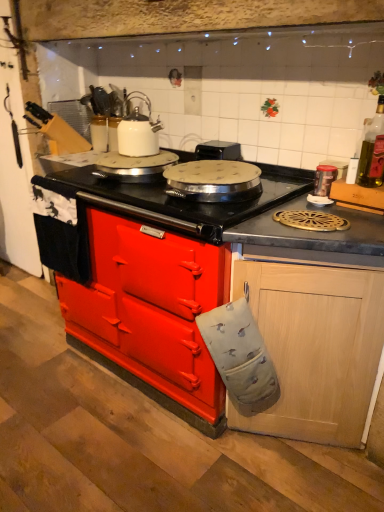
The height and width of the screenshot is (512, 384). In order to click on white glossy kettle at upper center, placed as the 2th kitchen appliance when sorted from right to left in this screenshot , I will do `click(138, 130)`.

This screenshot has width=384, height=512. Describe the element at coordinates (138, 130) in the screenshot. I see `white glossy kettle at upper center, the 1th kitchen appliance positioned from the back` at that location.

The width and height of the screenshot is (384, 512). Describe the element at coordinates (218, 150) in the screenshot. I see `black plastic toaster at upper center` at that location.

The image size is (384, 512). What do you see at coordinates (324, 179) in the screenshot?
I see `metallic silver canister at upper right, marked as the 1th kitchen appliance in a bottom-to-top arrangement` at bounding box center [324, 179].

Identify the location of black matte countertop at center. This screenshot has width=384, height=512. (128, 303).

Find the location of a particular element. This screenshot has width=384, height=512. green glass bottle at upper right is located at coordinates (372, 150).

The width and height of the screenshot is (384, 512). In order to click on the 1st kitchen appliance directly above the light wood/texture cabinet at lower right (from a real-world perspective) in this screenshot , I will do `click(324, 179)`.

Is light wood/texture cabinet at lower right placed right next to metallic silver canister at upper right, the first kitchen appliance viewed from the front?

No, light wood/texture cabinet at lower right is not next to metallic silver canister at upper right, the first kitchen appliance viewed from the front.

Is light wood/texture cabinet at lower right turned away from metallic silver canister at upper right, marked as the 1th kitchen appliance in a bottom-to-top arrangement?

No, metallic silver canister at upper right, marked as the 1th kitchen appliance in a bottom-to-top arrangement, is not at the back of light wood/texture cabinet at lower right.

From the image's perspective, which is below, light wood/texture cabinet at lower right or metallic silver canister at upper right, the first kitchen appliance viewed from the front?

light wood/texture cabinet at lower right.

Is green glass bottle at upper right not close to black plastic toaster at upper center?

No, green glass bottle at upper right is not far away from black plastic toaster at upper center.

From the picture: Is green glass bottle at upper right inside or outside of black plastic toaster at upper center?

green glass bottle at upper right is spatially situated outside black plastic toaster at upper center.

Who is smaller, green glass bottle at upper right or black plastic toaster at upper center?

With smaller size is green glass bottle at upper right.

Does green glass bottle at upper right contain light wood/texture cabinet at lower right?

No, light wood/texture cabinet at lower right is located outside of green glass bottle at upper right.

Based on the photo, are green glass bottle at upper right and light wood/texture cabinet at lower right located far from each other?

green glass bottle at upper right is near light wood/texture cabinet at lower right, not far away.

From the image's perspective, is green glass bottle at upper right located above or below light wood/texture cabinet at lower right?

Based on their image positions, green glass bottle at upper right is located above light wood/texture cabinet at lower right.

I want to click on the 2nd kitchen appliance directly beneath the green glass bottle at upper right (from a real-world perspective), so click(x=324, y=179).

From the image's perspective, which is above, metallic silver canister at upper right, marked as the 1th kitchen appliance in a bottom-to-top arrangement, or green glass bottle at upper right?

green glass bottle at upper right is shown above in the image.

Considering the relative positions of metallic silver canister at upper right, which ranks as the 1th kitchen appliance in right-to-left order, and green glass bottle at upper right in the image provided, is metallic silver canister at upper right, which ranks as the 1th kitchen appliance in right-to-left order, to the right of green glass bottle at upper right from the viewer's perspective?

No.

From a real-world perspective, is black plastic toaster at upper center positioned above or below green glass bottle at upper right?

In terms of real-world spatial position, black plastic toaster at upper center is below green glass bottle at upper right.

Considering the sizes of objects black plastic toaster at upper center and green glass bottle at upper right in the image provided, who is wider, black plastic toaster at upper center or green glass bottle at upper right?

Wider between the two is black plastic toaster at upper center.

Is black plastic toaster at upper center not near green glass bottle at upper right?

No, black plastic toaster at upper center is not far from green glass bottle at upper right.

Does point (237, 150) appear closer or farther from the camera than point (363, 159)?

Point (237, 150) appears to be farther away from the viewer than point (363, 159).

Which point is more distant from viewer, (205, 399) or (218, 148)?

The point (218, 148) is more distant.

Can you tell me how much black matte countertop at center and black plastic toaster at upper center differ in facing direction?

The angle between the facing direction of black matte countertop at center and the facing direction of black plastic toaster at upper center is 0.725 degrees.

From a real-world perspective, is black matte countertop at center beneath black plastic toaster at upper center?

Correct, in the physical world, black matte countertop at center is lower than black plastic toaster at upper center.

Consider the image. Who is taller, black matte countertop at center or black plastic toaster at upper center?

black matte countertop at center is taller.

Based on the photo, considering the positions of objects black matte countertop at center and metallic silver canister at upper right, the first kitchen appliance viewed from the front, in the image provided, who is in front, black matte countertop at center or metallic silver canister at upper right, the first kitchen appliance viewed from the front,?

black matte countertop at center is in front.

Considering the sizes of objects black matte countertop at center and metallic silver canister at upper right, placed as the second kitchen appliance when sorted from top to bottom, in the image provided, who is bigger, black matte countertop at center or metallic silver canister at upper right, placed as the second kitchen appliance when sorted from top to bottom,?

Bigger between the two is black matte countertop at center.

Is point (168, 224) more distant than point (321, 196)?

No, (168, 224) is in front of (321, 196).

Is black matte countertop at center facing towards metallic silver canister at upper right, the second kitchen appliance in the left-to-right sequence?

No, black matte countertop at center is not turned towards metallic silver canister at upper right, the second kitchen appliance in the left-to-right sequence.

Locate an element on the screen. The width and height of the screenshot is (384, 512). cabinetry in front of the metallic silver canister at upper right, which ranks as the 1th kitchen appliance in right-to-left order is located at coordinates (315, 348).

Locate an element on the screen. The height and width of the screenshot is (512, 384). bottle located below the black plastic toaster at upper center (from the image's perspective) is located at coordinates (372, 150).

Which object lies further to the anchor point white glossy kettle at upper center, which appears as the first kitchen appliance when viewed from the top, black matte countertop at center or black plastic toaster at upper center?

Based on the image, black matte countertop at center appears to be further to white glossy kettle at upper center, which appears as the first kitchen appliance when viewed from the top.

In the scene shown: Estimate the real-world distances between objects in this image. Which object is closer to green glass bottle at upper right, metallic silver canister at upper right, the 2th kitchen appliance from the back, or light wood/texture cabinet at lower right?

Based on the image, metallic silver canister at upper right, the 2th kitchen appliance from the back, appears to be nearer to green glass bottle at upper right.

Based on the photo, based on their spatial positions, is green glass bottle at upper right or light wood/texture cabinet at lower right further from metallic silver canister at upper right, the first kitchen appliance viewed from the front?

light wood/texture cabinet at lower right is further to metallic silver canister at upper right, the first kitchen appliance viewed from the front.

Which object lies further to the anchor point green glass bottle at upper right, metallic silver canister at upper right, the second kitchen appliance in the left-to-right sequence, or white glossy kettle at upper center, which appears as the first kitchen appliance when viewed from the top?

white glossy kettle at upper center, which appears as the first kitchen appliance when viewed from the top, lies further to green glass bottle at upper right than the other object.

When comparing their distances from black plastic toaster at upper center, does light wood/texture cabinet at lower right or black matte countertop at center seem further?

The object further to black plastic toaster at upper center is light wood/texture cabinet at lower right.

Looking at the image, which one is located closer to green glass bottle at upper right, light wood/texture cabinet at lower right or black matte countertop at center?

light wood/texture cabinet at lower right is positioned closer to the anchor green glass bottle at upper right.

Estimate the real-world distances between objects in this image. Which object is closer to metallic silver canister at upper right, the 2th kitchen appliance from the back, black matte countertop at center or white glossy kettle at upper center, the 1th kitchen appliance positioned from the back?

Among the two, white glossy kettle at upper center, the 1th kitchen appliance positioned from the back, is located nearer to metallic silver canister at upper right, the 2th kitchen appliance from the back.

Considering their positions, is white glossy kettle at upper center, placed as the 2th kitchen appliance when sorted from right to left, positioned further to metallic silver canister at upper right, marked as the 1th kitchen appliance in a bottom-to-top arrangement, than light wood/texture cabinet at lower right?

white glossy kettle at upper center, placed as the 2th kitchen appliance when sorted from right to left, is further to metallic silver canister at upper right, marked as the 1th kitchen appliance in a bottom-to-top arrangement.

This screenshot has width=384, height=512. What are the coordinates of `kitchen appliance between black matte countertop at center and green glass bottle at upper right` in the screenshot? It's located at (324, 179).

At what (x,y) coordinates should I click in order to perform the action: click on bottle between light wood/texture cabinet at lower right and black plastic toaster at upper center in the front-back direction. Please return your answer as a coordinate pair (x, y). This screenshot has width=384, height=512. Looking at the image, I should click on (372, 150).

You are a GUI agent. You are given a task and a screenshot of the screen. Output one action in this format:
    pyautogui.click(x=<x>, y=<y>)
    Task: Click on the countertop between white glossy kettle at upper center, the 1th kitchen appliance from the left, and light wood/texture cabinet at lower right from top to bottom
    The height and width of the screenshot is (512, 384).
    Given the screenshot: What is the action you would take?
    pyautogui.click(x=128, y=303)

Identify the location of appliance between white glossy kettle at upper center, placed as the 2th kitchen appliance when sorted from right to left, and metallic silver canister at upper right, placed as the second kitchen appliance when sorted from top to bottom. (218, 150).